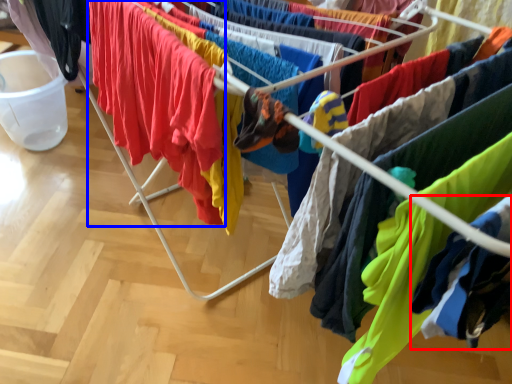
Question: Which of the following is the closest to the observer, clothing (highlighted by a red box) or clothing (highlighted by a blue box)?

Choices:
 (A) clothing
 (B) clothing

Answer: (A)